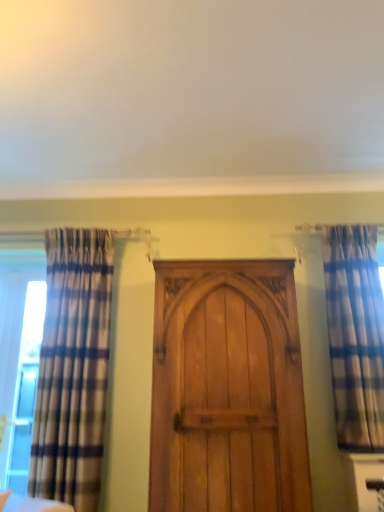
Question: Visually, is clear glass window at left positioned to the left or to the right of plaid fabric curtain at left, the second curtain in the right-to-left sequence?

Choices:
 (A) right
 (B) left

Answer: (B)

Question: From the image's perspective, is clear glass window at left positioned above or below plaid fabric curtain at left, the second curtain in the right-to-left sequence?

Choices:
 (A) below
 (B) above

Answer: (A)

Question: Estimate the real-world distances between objects in this image. Which object is closer to the plaid fabric curtain at right, positioned as the first curtain in right-to-left order?

Choices:
 (A) plaid fabric curtain at left, the second curtain in the right-to-left sequence
 (B) light brown wood door at center
 (C) wooden door at center
 (D) clear glass window at left

Answer: (B)

Question: Which is nearer to the clear glass window at left?

Choices:
 (A) wooden door at center
 (B) light brown wood door at center
 (C) plaid fabric curtain at right, the 2th curtain when ordered from left to right
 (D) plaid fabric curtain at left, the second curtain in the right-to-left sequence

Answer: (D)